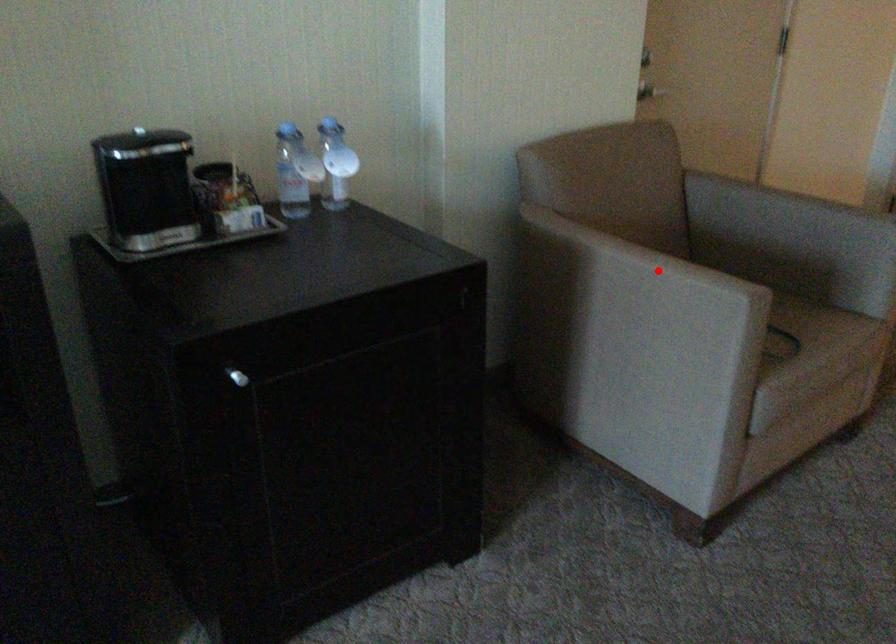
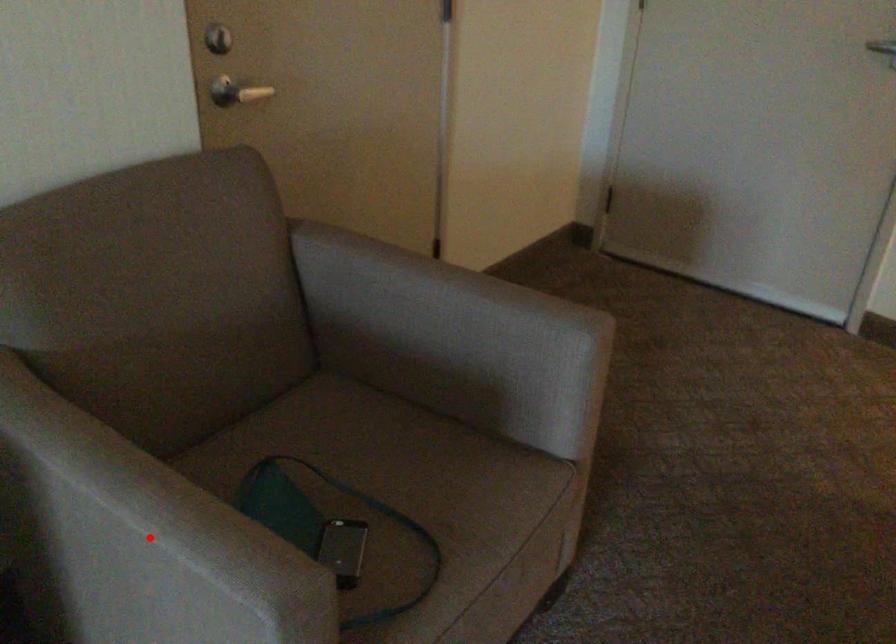
I am providing you with two images of the same scene from different viewpoints. A red point is marked on the first image and another point is marked on the second image. Does the point marked in image1 correspond to the same location as the one in image2?

Yes